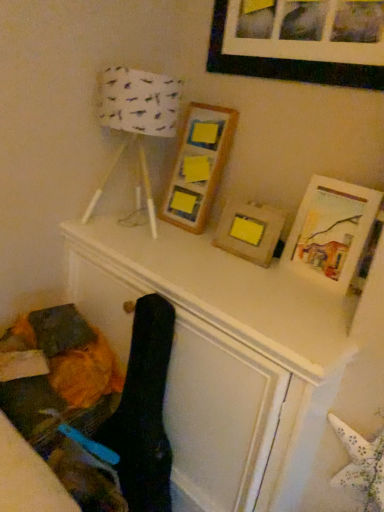
Question: From the image's perspective, is black matte picture frame at upper center, which ranks as the first picture frame in top-to-bottom order, on white paper lampshade at upper left?

Choices:
 (A) no
 (B) yes

Answer: (B)

Question: Is black matte picture frame at upper center, placed as the 4th picture frame when sorted from bottom to top, outside of white paper lampshade at upper left?

Choices:
 (A) yes
 (B) no

Answer: (A)

Question: Can you confirm if black matte picture frame at upper center, placed as the 4th picture frame when sorted from bottom to top, is thinner than white paper lampshade at upper left?

Choices:
 (A) yes
 (B) no

Answer: (A)

Question: Does black matte picture frame at upper center, placed as the 4th picture frame when sorted from bottom to top, have a lesser height compared to white paper lampshade at upper left?

Choices:
 (A) no
 (B) yes

Answer: (B)

Question: Does black matte picture frame at upper center, placed as the 4th picture frame when sorted from bottom to top, appear on the right side of white paper lampshade at upper left?

Choices:
 (A) yes
 (B) no

Answer: (A)

Question: Is black matte picture frame at upper center, placed as the 4th picture frame when sorted from bottom to top, looking in the opposite direction of white paper lampshade at upper left?

Choices:
 (A) yes
 (B) no

Answer: (B)

Question: From a real-world perspective, does wooden frame at center, which appears as the second picture frame when viewed from the top, stand above wooden picture frame at center, which is the second picture frame in bottom-to-top order?

Choices:
 (A) no
 (B) yes

Answer: (B)

Question: Does wooden frame at center, the 3th picture frame positioned from the bottom, have a lesser height compared to wooden picture frame at center, which is the second picture frame in bottom-to-top order?

Choices:
 (A) yes
 (B) no

Answer: (B)

Question: Considering the relative sizes of wooden frame at center, the 3th picture frame positioned from the bottom, and wooden picture frame at center, which appears as the third picture frame when viewed from the top, in the image provided, is wooden frame at center, the 3th picture frame positioned from the bottom, wider than wooden picture frame at center, which appears as the third picture frame when viewed from the top,?

Choices:
 (A) no
 (B) yes

Answer: (B)

Question: Can you confirm if wooden frame at center, which appears as the second picture frame when viewed from the top, is positioned to the right of wooden picture frame at center, which is the second picture frame in bottom-to-top order?

Choices:
 (A) yes
 (B) no

Answer: (B)

Question: Does wooden frame at center, the 3th picture frame positioned from the bottom, have a smaller size compared to wooden picture frame at center, which appears as the third picture frame when viewed from the top?

Choices:
 (A) no
 (B) yes

Answer: (A)

Question: Would you consider wooden frame at center, the 3th picture frame positioned from the bottom, to be distant from wooden picture frame at center, which is the second picture frame in bottom-to-top order?

Choices:
 (A) yes
 (B) no

Answer: (B)

Question: Can you confirm if white paper lampshade at upper left is thinner than black matte picture frame at upper center, which ranks as the first picture frame in top-to-bottom order?

Choices:
 (A) yes
 (B) no

Answer: (B)